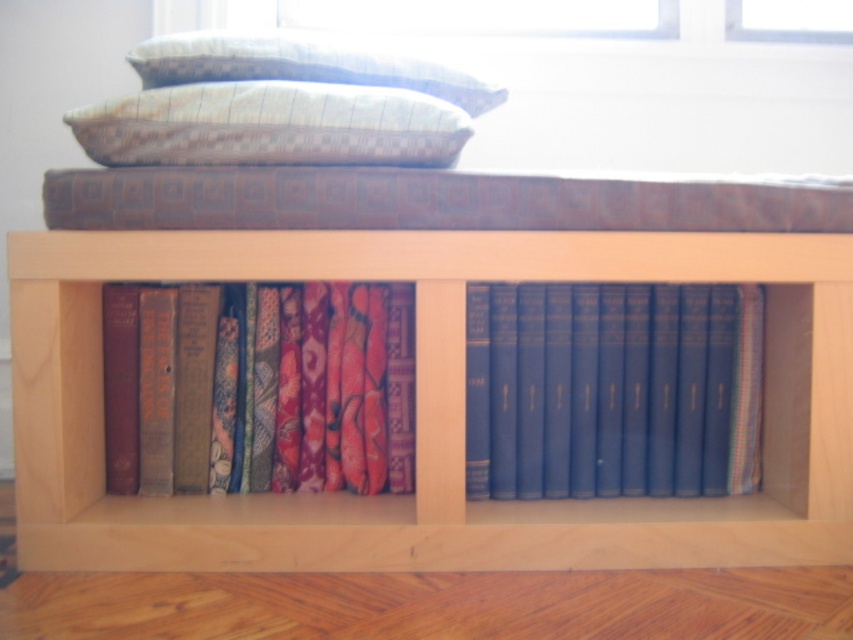
Question: Is the position of wooden bookcase at center less distant than that of multicolored fabric at center?

Choices:
 (A) no
 (B) yes

Answer: (B)

Question: Which of the following is the closest to the observer?

Choices:
 (A) checkered fabric pillow at upper center
 (B) multicolored fabric at center
 (C) patterned fabric pillow at upper center
 (D) blue hardcover books at center

Answer: (A)

Question: Among these objects, which one is farthest from the camera?

Choices:
 (A) multicolored fabric at center
 (B) checkered fabric pillow at upper center

Answer: (A)

Question: Which is farther from the blue hardcover books at center?

Choices:
 (A) multicolored fabric at center
 (B) checkered fabric pillow at upper center

Answer: (B)

Question: Is blue hardcover books at center to the right of patterned fabric pillow at upper center from the viewer's perspective?

Choices:
 (A) no
 (B) yes

Answer: (B)

Question: Does wooden bookcase at center lie in front of multicolored fabric at center?

Choices:
 (A) yes
 (B) no

Answer: (A)